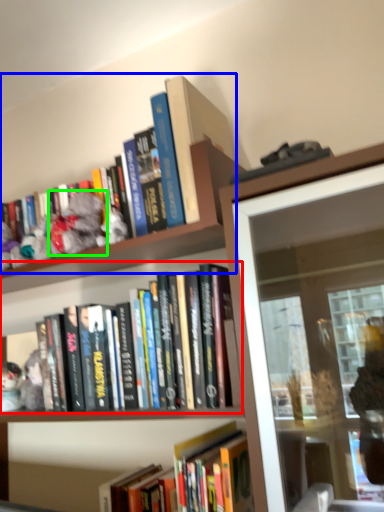
Question: Considering the real-world distances, which object is closest to book (highlighted by a red box)? book (highlighted by a blue box) or toy (highlighted by a green box).

Choices:
 (A) book
 (B) toy

Answer: (A)